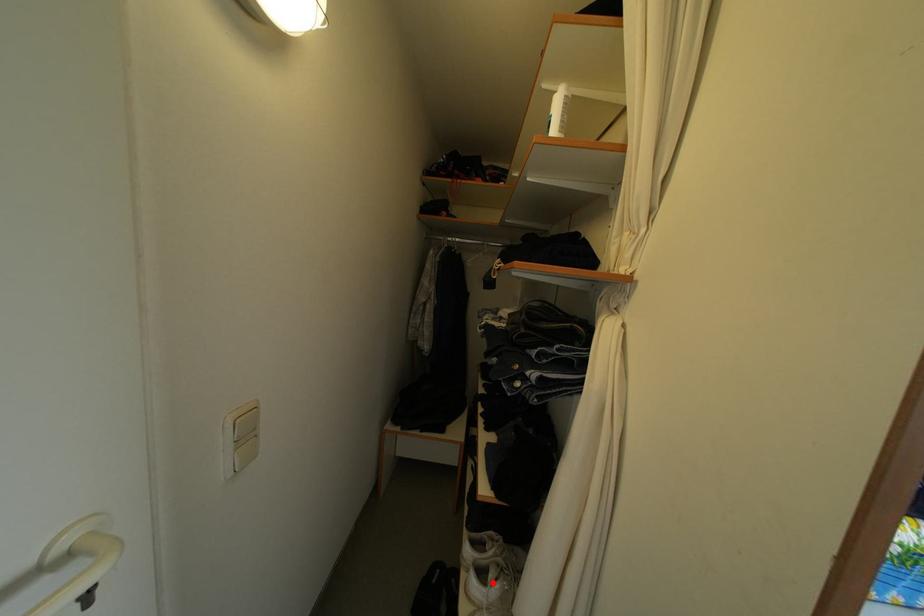
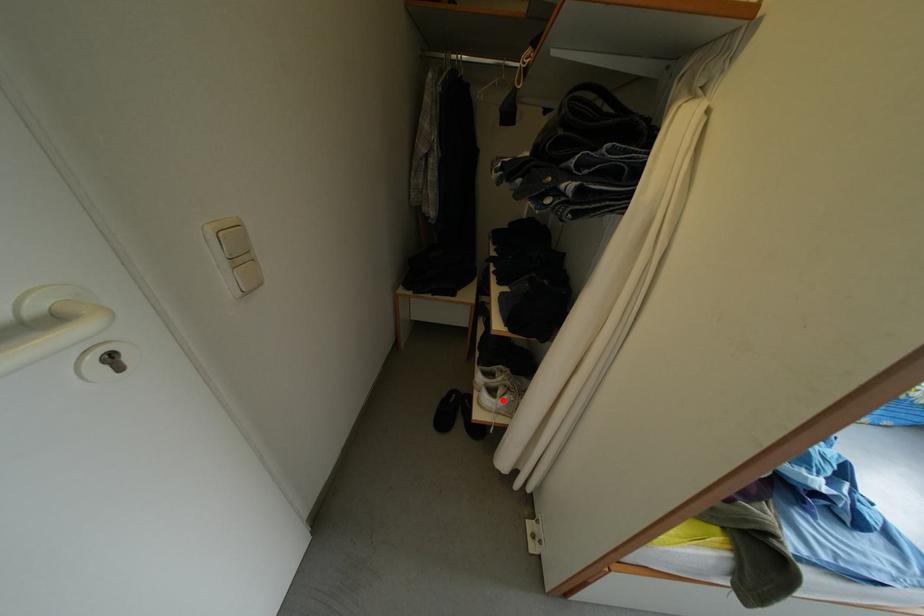
I am providing you with two images of the same scene from different viewpoints. A red point is marked on the first image and another point is marked on the second image. Is the marked point in image1 the same physical position as the marked point in image2?

Yes